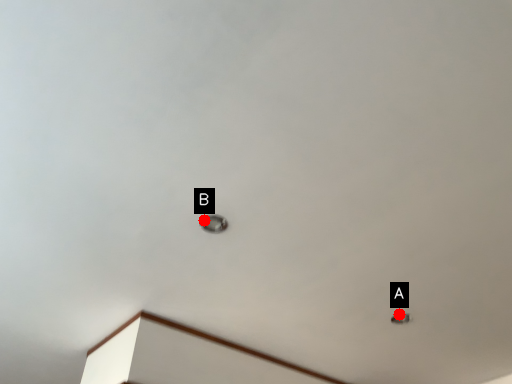
Question: Two points are circled on the image, labeled by A and B beside each circle. Which point is farther to the camera?

Choices:
 (A) A is further
 (B) B is further

Answer: (A)